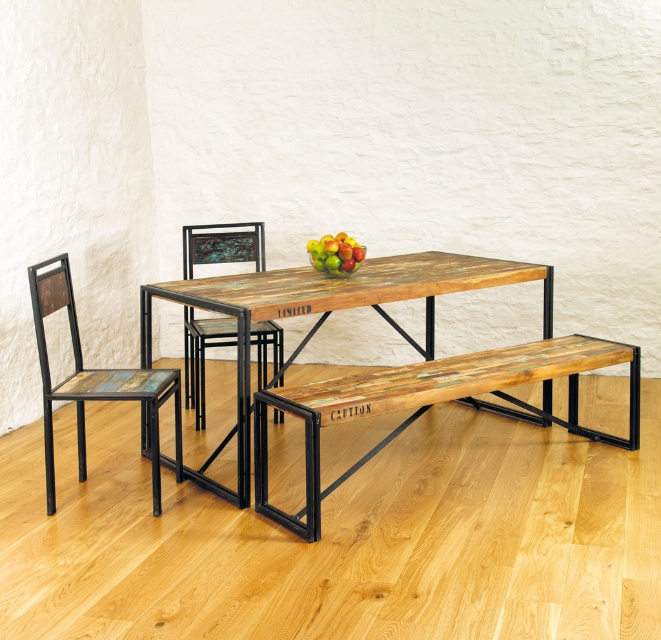
You are standing at the point marked by the coordinates point (434, 403). What object are you directly in front of?

You are directly in front of the reclaimed wood bench at center, as the coordinates point (434, 403) marks this location.

You are planning to seat guests at the dining table. The reclaimed wood bench at center and the rustic wood chair at center are both available. If you want to maximize seating capacity, which one should you choose?

The rustic wood chair at center should be chosen to maximize seating capacity because the reclaimed wood bench at center is wider, taking up more space and allowing fewer chairs to be placed around the table.

You are setting up a small dining area in your apartment and have a 20 inch wide dining cart that you want to place between the reclaimed wood bench at center and the reclaimed wood table at center. Can the cart fit in the space between them?

The distance between the reclaimed wood bench at center and the reclaimed wood table at center is 17.65 inches. Since the cart is 20 inches wide, it cannot fit in the space between them as the available space is narrower than the cart.